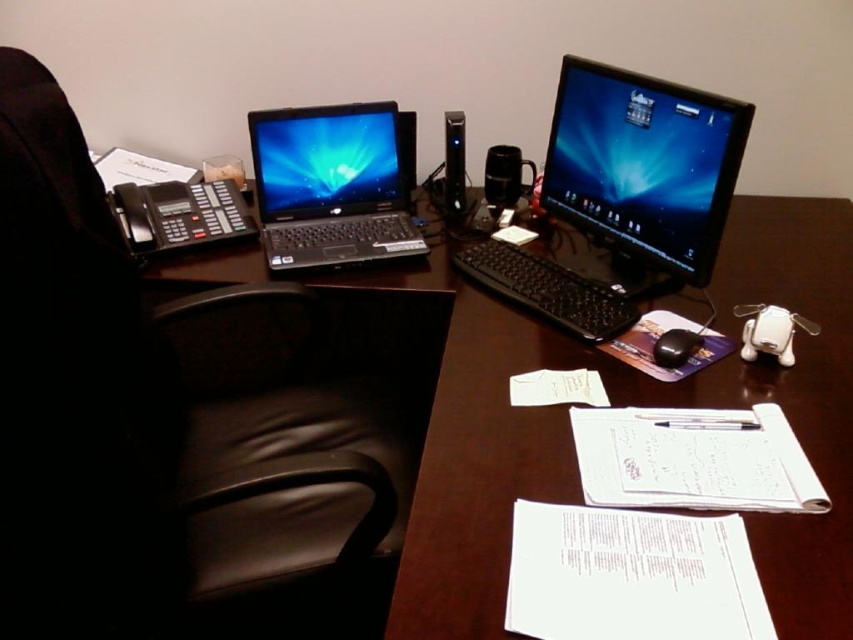
You are an office worker who needs to locate the black plastic phone at left on your desk. According to the desk layout, where would you find it in terms of coordinates?

The black plastic phone at left is located at coordinates point (180, 214).

You are sitting at the desk and want to pick up the black plastic phone at left to make a call. However, the shiny black laptop at left is blocking your access. Can you move the laptop to the right to clear the path?

The shiny black laptop at left is located above the black plastic phone at left, so moving it to the right would not necessarily unblock the phone. You might need to move it forward or backward instead.

You are organizing a meeting in the workspace and need to position a 24 inch projector screen between the black leather swivel chair at left and the satin black monitor at center. Is there enough space between them to place the projector screen?

The distance between the black leather swivel chair at left and the satin black monitor at center is 30.51 inches. Since the projector screen is 24 inches wide, there is sufficient space to place it between them as the available space is larger than the screen width.